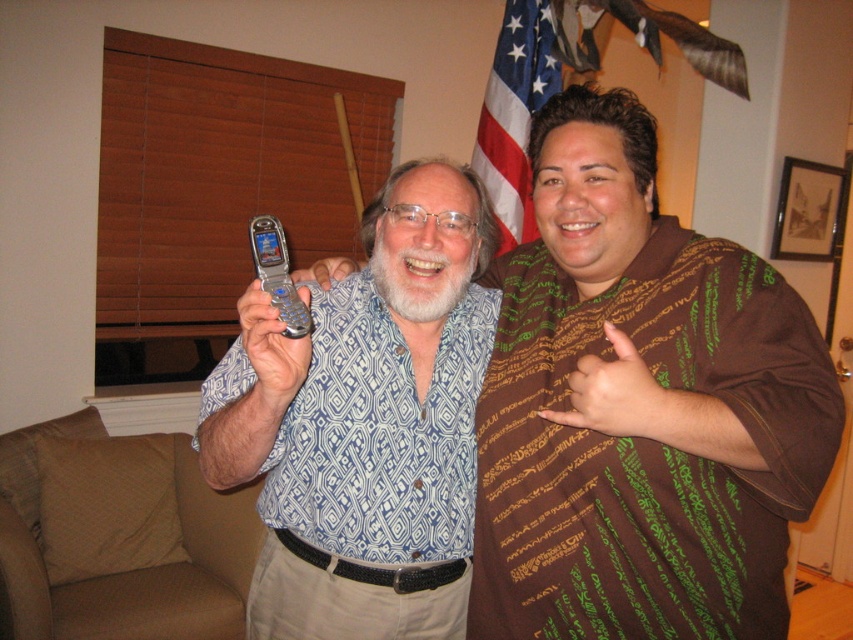
Consider the image. Can you confirm if silver metallic flip phone at center is smaller than silver metallic phone at center?

No, silver metallic flip phone at center is not smaller than silver metallic phone at center.

Is silver metallic flip phone at center further to camera compared to silver metallic phone at center?

No, silver metallic flip phone at center is in front of silver metallic phone at center.

Which is in front, point (469, 518) or point (277, 273)?

Point (277, 273)

Locate an element on the screen. silver metallic flip phone at center is located at coordinates click(x=364, y=426).

Is silver metallic flip phone at center wider than american flag at upper center?

Correct, the width of silver metallic flip phone at center exceeds that of american flag at upper center.

Is silver metallic flip phone at center further to the viewer compared to american flag at upper center?

No, silver metallic flip phone at center is closer to the viewer.

Between point (375, 216) and point (546, 38), which one is positioned behind?

The point (546, 38) is more distant.

Locate an element on the screen. This screenshot has height=640, width=853. silver metallic flip phone at center is located at coordinates (364, 426).

Is metallic silver flip phone at center positioned in front of silver metallic phone at center?

Yes, metallic silver flip phone at center is closer to the viewer.

Which is in front, point (625, 561) or point (274, 220)?

Point (274, 220) is in front.

In order to click on metallic silver flip phone at center in this screenshot , I will do `click(639, 406)`.